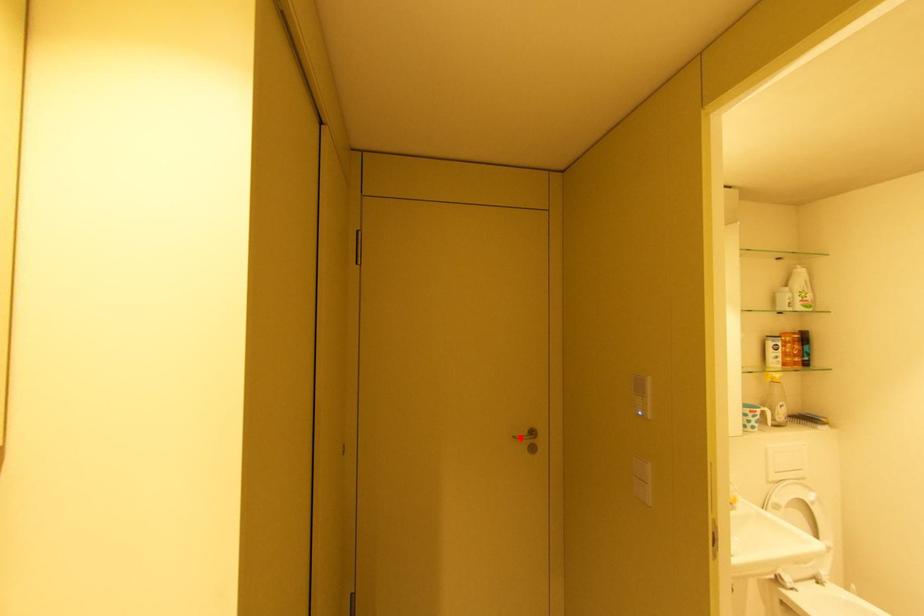
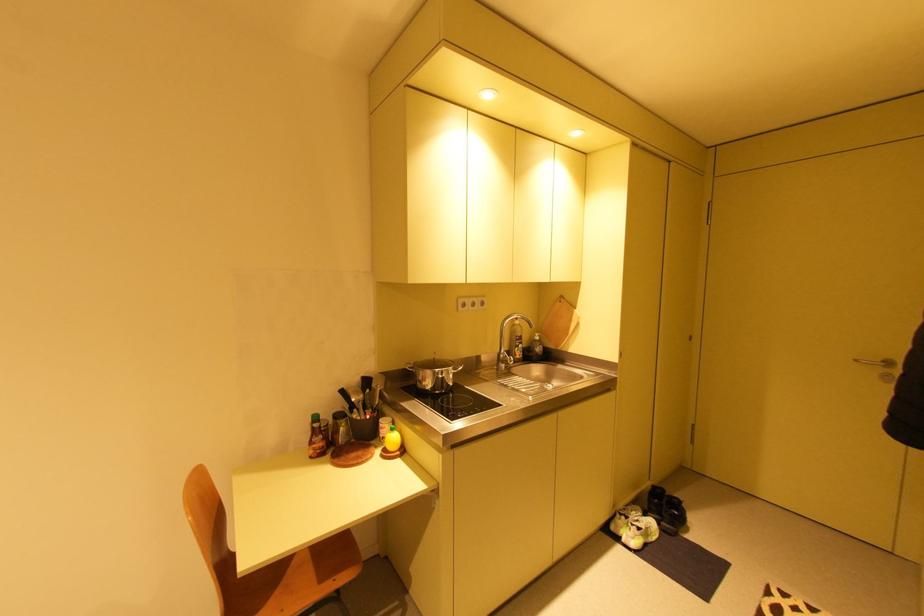
Question: I am providing you with two images of the same scene from different viewpoints. Given a red point in image1, look at the same physical point in image2. Is it:

Choices:
 (A) Closer to the viewpoint
 (B) Farther from the viewpoint

Answer: (B)